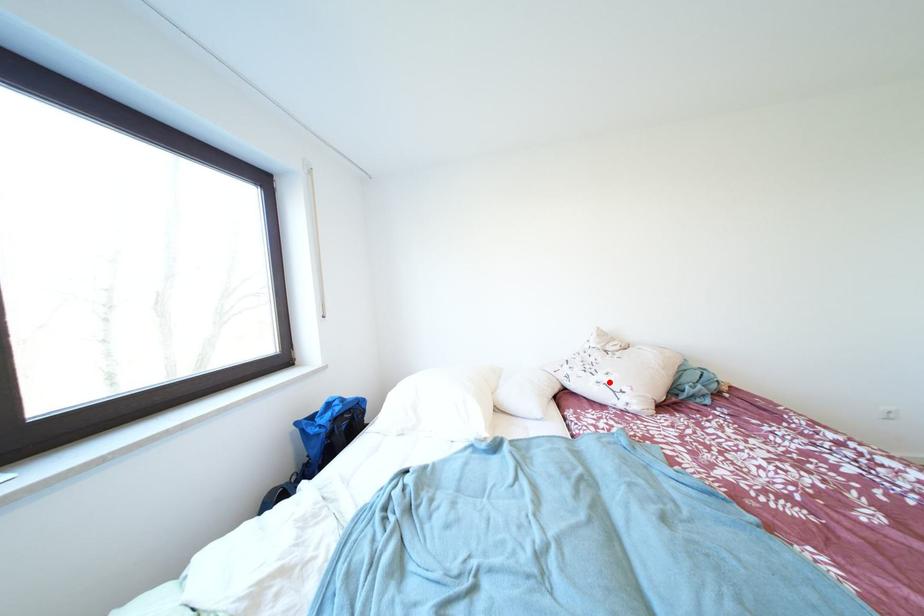
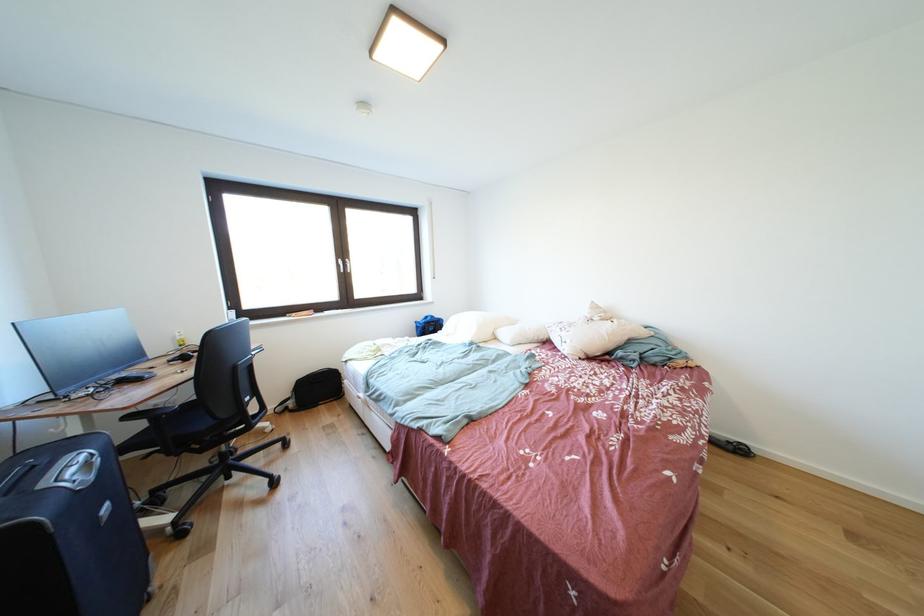
Question: I am providing you with two images of the same scene from different viewpoints. Image1 has a red point marked. In image2, the corresponding 3D location appears at what relative position? Reply with the corresponding letter.

Choices:
 (A) Closer
 (B) Farther

Answer: (A)